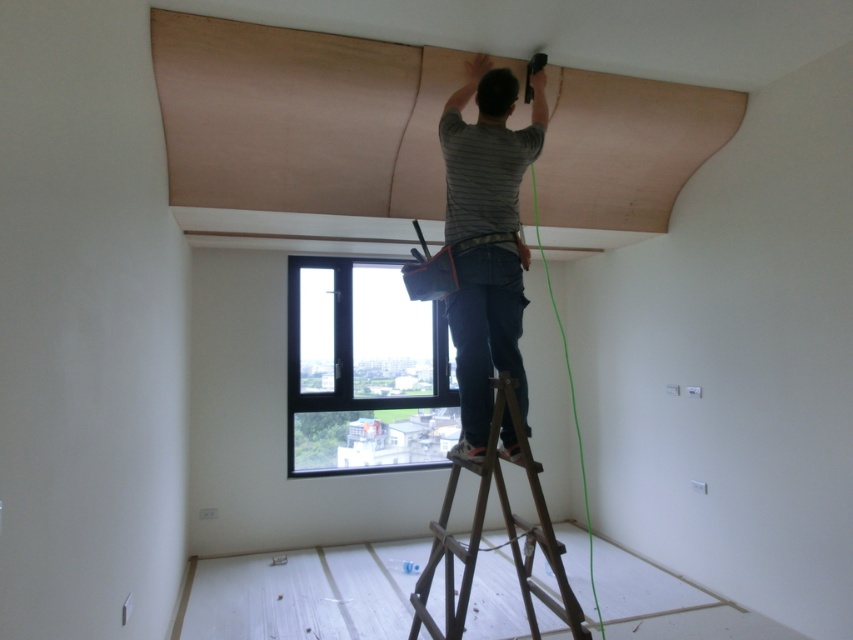
Can you confirm if gray striped shirt at upper center is positioned above brown wooden ladder at center?

Yes.

Does gray striped shirt at upper center have a greater height compared to brown wooden ladder at center?

Indeed, gray striped shirt at upper center has a greater height compared to brown wooden ladder at center.

Is point (529, 141) farther from camera compared to point (498, 465)?

Yes, point (529, 141) is behind point (498, 465).

You are a GUI agent. You are given a task and a screenshot of the screen. Output one action in this format:
    pyautogui.click(x=<x>, y=<y>)
    Task: Click on the gray striped shirt at upper center
    
    Given the screenshot: What is the action you would take?
    pyautogui.click(x=486, y=237)

Can you confirm if black plastic window at center is positioned to the left of gray striped shirt at upper center?

Correct, you'll find black plastic window at center to the left of gray striped shirt at upper center.

Who is shorter, black plastic window at center or gray striped shirt at upper center?

black plastic window at center is shorter.

I want to click on black plastic window at center, so pyautogui.click(x=363, y=371).

Where is `black plastic window at center`? This screenshot has height=640, width=853. black plastic window at center is located at coordinates (363, 371).

Does black plastic window at center appear on the left side of brown wooden ladder at center?

Yes, black plastic window at center is to the left of brown wooden ladder at center.

Is black plastic window at center above brown wooden ladder at center?

Yes, black plastic window at center is above brown wooden ladder at center.

Locate an element on the screen. black plastic window at center is located at coordinates (363, 371).